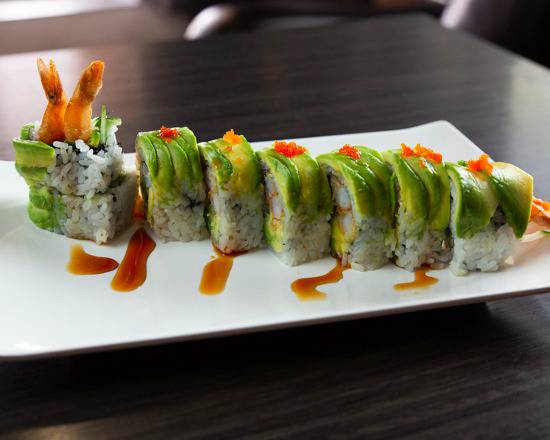
Image resolution: width=550 pixels, height=440 pixels. I want to click on empty space on table above sushi roll, so click(x=317, y=75).